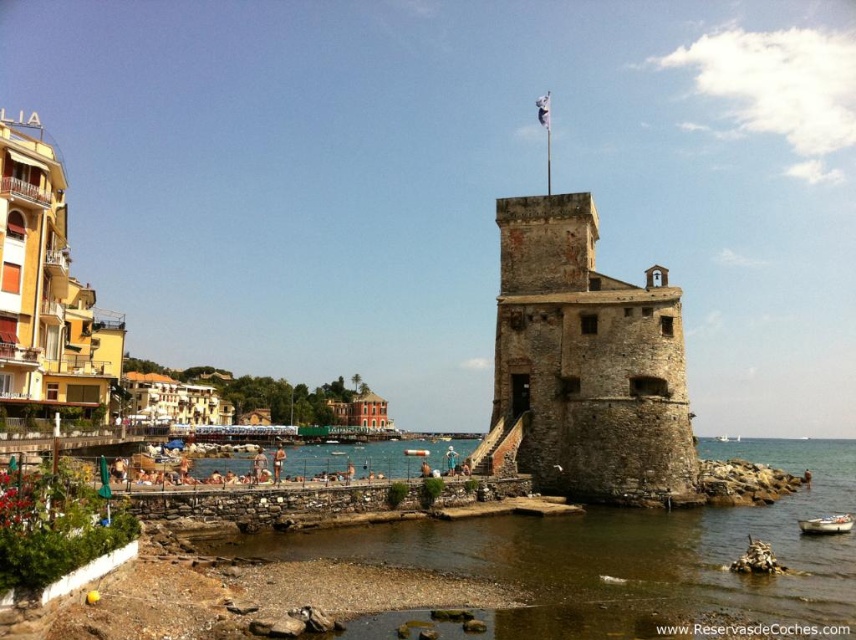
Can you confirm if clear water at lower center is bigger than white plastic buoy at center?

Indeed, clear water at lower center has a larger size compared to white plastic buoy at center.

Can you confirm if clear water at lower center is smaller than white plastic buoy at center?

Incorrect, clear water at lower center is not smaller in size than white plastic buoy at center.

Which is behind, point (720, 596) or point (409, 452)?

Positioned behind is point (409, 452).

What are the coordinates of `clear water at lower center` in the screenshot? It's located at (627, 556).

Which of these two, rusty stone tower at center or white wooden boat at lower right, stands taller?

rusty stone tower at center

Who is positioned more to the right, rusty stone tower at center or white wooden boat at lower right?

white wooden boat at lower right

Is point (666, 275) positioned in front of point (801, 520)?

No.

Find the location of `rusty stone tower at center`. rusty stone tower at center is located at coordinates (586, 364).

Between clear water at lower center and white wooden boat at lower right, which one is positioned lower?

clear water at lower center

At what (x,y) coordinates should I click in order to perform the action: click on clear water at lower center. Please return your answer as a coordinate pair (x, y). The height and width of the screenshot is (640, 856). Looking at the image, I should click on (627, 556).